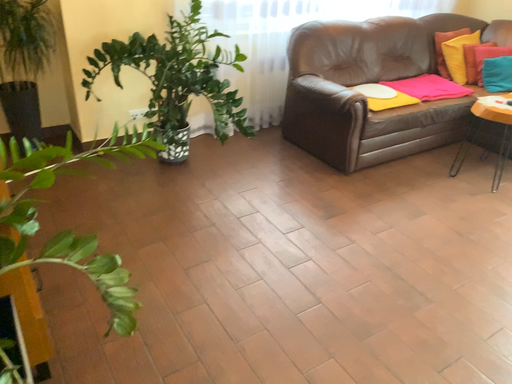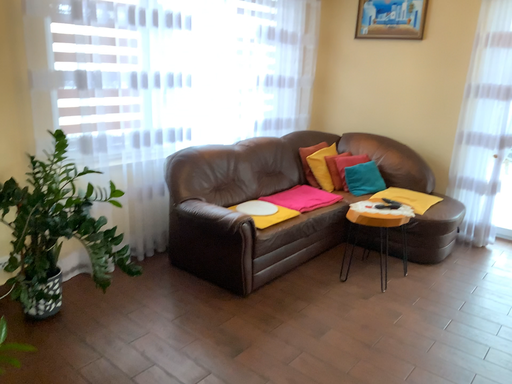
Question: Which way did the camera rotate in the video?

Choices:
 (A) rotated downward
 (B) rotated upward

Answer: (B)